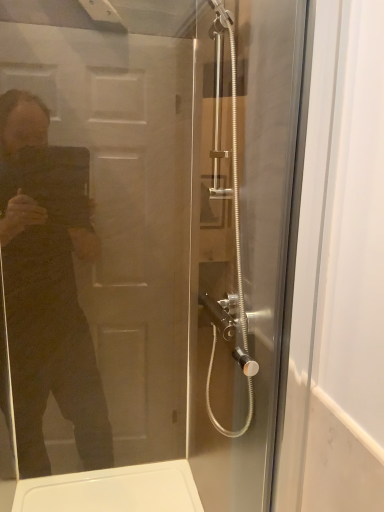
The image size is (384, 512). Find the location of `clear glass shower door at center, the 1th screen door positioned from the back`. clear glass shower door at center, the 1th screen door positioned from the back is located at coordinates 244,245.

The image size is (384, 512). What do you see at coordinates (244, 245) in the screenshot?
I see `clear glass shower door at center, the 1th screen door positioned from the back` at bounding box center [244, 245].

What do you see at coordinates (96, 247) in the screenshot?
I see `clear glass shower door at center, acting as the 1th screen door starting from the front` at bounding box center [96, 247].

What is the approximate height of clear glass shower door at center, the 2th screen door when ordered from back to front?

1.02 meters.

Where is `clear glass shower door at center, acting as the 1th screen door starting from the front`? Image resolution: width=384 pixels, height=512 pixels. clear glass shower door at center, acting as the 1th screen door starting from the front is located at coordinates (96, 247).

In order to click on clear glass shower door at center, which appears as the second screen door when viewed from the front in this screenshot , I will do `click(244, 245)`.

Does clear glass shower door at center, the 2th screen door when ordered from back to front, appear on the right side of clear glass shower door at center, the 1th screen door positioned from the back?

No, clear glass shower door at center, the 2th screen door when ordered from back to front, is not to the right of clear glass shower door at center, the 1th screen door positioned from the back.

Considering the positions of objects clear glass shower door at center, acting as the 1th screen door starting from the front, and clear glass shower door at center, the 1th screen door positioned from the back, in the image provided, who is in front, clear glass shower door at center, acting as the 1th screen door starting from the front, or clear glass shower door at center, the 1th screen door positioned from the back,?

clear glass shower door at center, acting as the 1th screen door starting from the front.

Considering the positions of point (16, 250) and point (265, 475), is point (16, 250) closer or farther from the camera than point (265, 475)?

Point (16, 250) is positioned farther from the camera compared to point (265, 475).

From the image's perspective, between clear glass shower door at center, acting as the 1th screen door starting from the front, and clear glass shower door at center, the 1th screen door positioned from the back, which one is located above?

clear glass shower door at center, the 1th screen door positioned from the back, is shown above in the image.

From a real-world perspective, is clear glass shower door at center, the 2th screen door when ordered from back to front, above or below clear glass shower door at center, the 1th screen door positioned from the back?

clear glass shower door at center, the 2th screen door when ordered from back to front, is below clear glass shower door at center, the 1th screen door positioned from the back.

In terms of width, does clear glass shower door at center, the 2th screen door when ordered from back to front, look wider or thinner when compared to clear glass shower door at center, which appears as the second screen door when viewed from the front?

Clearly, clear glass shower door at center, the 2th screen door when ordered from back to front, has less width compared to clear glass shower door at center, which appears as the second screen door when viewed from the front.

Between clear glass shower door at center, acting as the 1th screen door starting from the front, and clear glass shower door at center, the 1th screen door positioned from the back, which one has more height?

clear glass shower door at center, the 1th screen door positioned from the back, is taller.

Considering the sizes of objects clear glass shower door at center, acting as the 1th screen door starting from the front, and clear glass shower door at center, the 1th screen door positioned from the back, in the image provided, who is smaller, clear glass shower door at center, acting as the 1th screen door starting from the front, or clear glass shower door at center, the 1th screen door positioned from the back,?

clear glass shower door at center, acting as the 1th screen door starting from the front, is smaller.

Is clear glass shower door at center, the 2th screen door when ordered from back to front, spatially inside clear glass shower door at center, the 1th screen door positioned from the back, or outside of it?

clear glass shower door at center, the 2th screen door when ordered from back to front, is not enclosed by clear glass shower door at center, the 1th screen door positioned from the back.

Is clear glass shower door at center, the 2th screen door when ordered from back to front, oriented towards clear glass shower door at center, which appears as the second screen door when viewed from the front?

Yes, clear glass shower door at center, the 2th screen door when ordered from back to front, is oriented towards clear glass shower door at center, which appears as the second screen door when viewed from the front.

Can you tell me how much clear glass shower door at center, acting as the 1th screen door starting from the front, and clear glass shower door at center, which appears as the second screen door when viewed from the front, differ in facing direction?

The facing directions of clear glass shower door at center, acting as the 1th screen door starting from the front, and clear glass shower door at center, which appears as the second screen door when viewed from the front, are 88.1 degrees apart.

The image size is (384, 512). Identify the location of screen door that is below the clear glass shower door at center, the 1th screen door positioned from the back (from the image's perspective). [x=96, y=247].

Between clear glass shower door at center, the 1th screen door positioned from the back, and clear glass shower door at center, the 2th screen door when ordered from back to front, which one appears on the right side from the viewer's perspective?

From the viewer's perspective, clear glass shower door at center, the 1th screen door positioned from the back, appears more on the right side.

Which object is further away from the camera, clear glass shower door at center, which appears as the second screen door when viewed from the front, or clear glass shower door at center, acting as the 1th screen door starting from the front?

clear glass shower door at center, which appears as the second screen door when viewed from the front, is more distant.

Does point (262, 85) come closer to viewer compared to point (17, 105)?

No, it is behind (17, 105).

Based on the photo, from the image's perspective, is clear glass shower door at center, which appears as the second screen door when viewed from the front, over clear glass shower door at center, the 2th screen door when ordered from back to front?

Yes, from the image's perspective, clear glass shower door at center, which appears as the second screen door when viewed from the front, is above clear glass shower door at center, the 2th screen door when ordered from back to front.

From a real-world perspective, which is physically above, clear glass shower door at center, which appears as the second screen door when viewed from the front, or clear glass shower door at center, acting as the 1th screen door starting from the front?

From a 3D spatial view, clear glass shower door at center, which appears as the second screen door when viewed from the front, is above.

Looking at this image, does clear glass shower door at center, the 1th screen door positioned from the back, have a greater width compared to clear glass shower door at center, the 2th screen door when ordered from back to front?

Indeed, clear glass shower door at center, the 1th screen door positioned from the back, has a greater width compared to clear glass shower door at center, the 2th screen door when ordered from back to front.

Which of these two, clear glass shower door at center, the 1th screen door positioned from the back, or clear glass shower door at center, acting as the 1th screen door starting from the front, stands shorter?

clear glass shower door at center, acting as the 1th screen door starting from the front, is shorter.

Can you confirm if clear glass shower door at center, the 1th screen door positioned from the back, is bigger than clear glass shower door at center, the 2th screen door when ordered from back to front?

Yes, clear glass shower door at center, the 1th screen door positioned from the back, is bigger than clear glass shower door at center, the 2th screen door when ordered from back to front.

Can we say clear glass shower door at center, the 1th screen door positioned from the back, lies outside clear glass shower door at center, acting as the 1th screen door starting from the front?

Yes, clear glass shower door at center, the 1th screen door positioned from the back, is not within clear glass shower door at center, acting as the 1th screen door starting from the front.

Are clear glass shower door at center, which appears as the second screen door when viewed from the front, and clear glass shower door at center, acting as the 1th screen door starting from the front, far apart?

That's not correct — clear glass shower door at center, which appears as the second screen door when viewed from the front, is a little close to clear glass shower door at center, acting as the 1th screen door starting from the front.

Is clear glass shower door at center, which appears as the second screen door when viewed from the front, positioned with its back to clear glass shower door at center, acting as the 1th screen door starting from the front?

No, clear glass shower door at center, which appears as the second screen door when viewed from the front,'s orientation is not away from clear glass shower door at center, acting as the 1th screen door starting from the front.

Locate an element on the screen. This screenshot has height=512, width=384. screen door to the left of clear glass shower door at center, the 1th screen door positioned from the back is located at coordinates (96, 247).

This screenshot has width=384, height=512. Find the location of `screen door to the right of clear glass shower door at center, the 2th screen door when ordered from back to front`. screen door to the right of clear glass shower door at center, the 2th screen door when ordered from back to front is located at coordinates (244, 245).

Where is `screen door in front of the clear glass shower door at center, the 1th screen door positioned from the back`? This screenshot has height=512, width=384. screen door in front of the clear glass shower door at center, the 1th screen door positioned from the back is located at coordinates (96, 247).